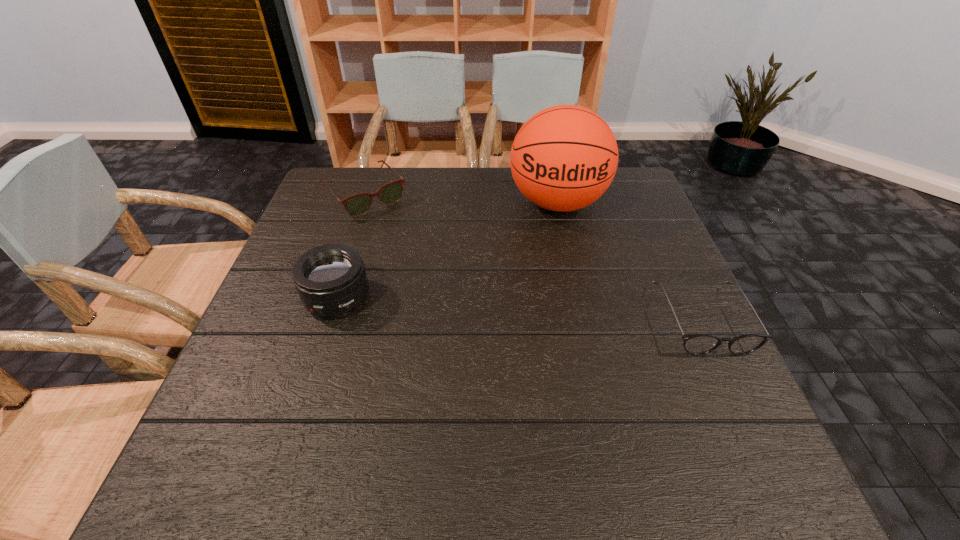
Find the location of a particular element. vacant spot on the desktop that is between the second tallest object and the rightmost object and is positioned at the front view of the farther spectacles is located at coordinates (468, 306).

The width and height of the screenshot is (960, 540). I want to click on vacant space on the desktop that is between the telephoto lens and the nearer spectacles and is positioned on the side with logo of the third object from left to right, so click(561, 311).